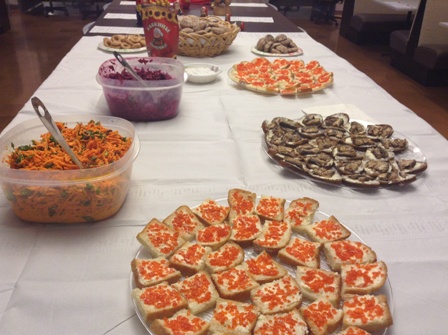
I want to click on floor, so click(x=42, y=39).